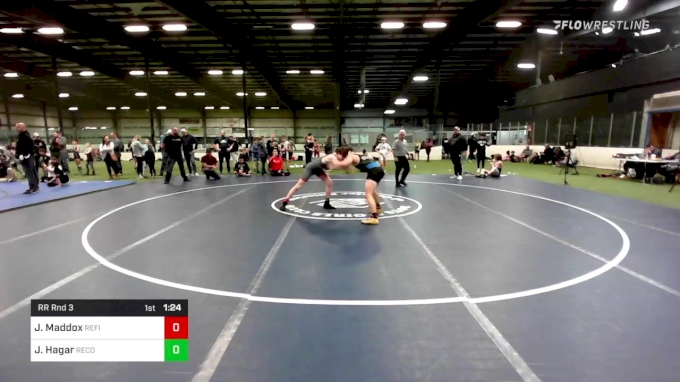
Locate an element on the screen. wrestling mat is located at coordinates (318, 352).